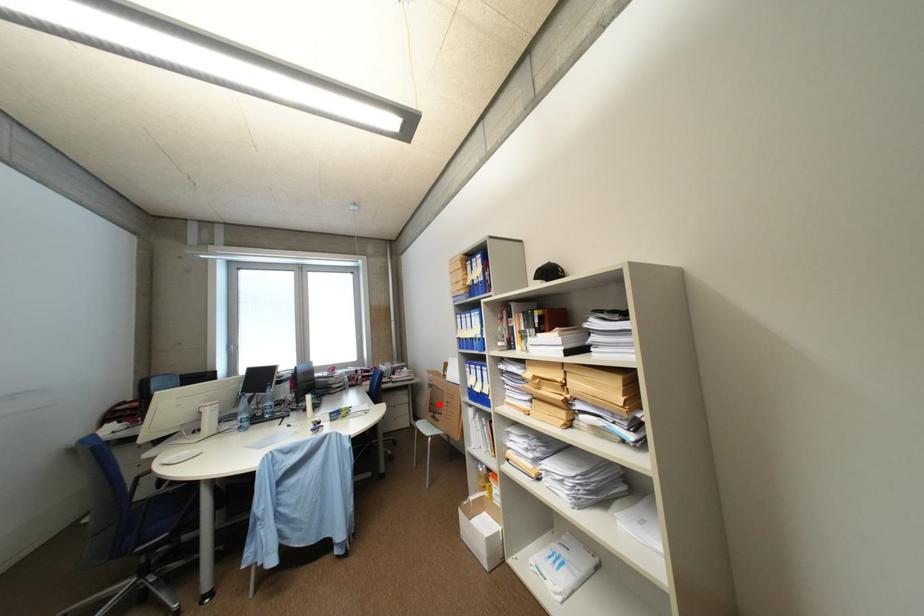
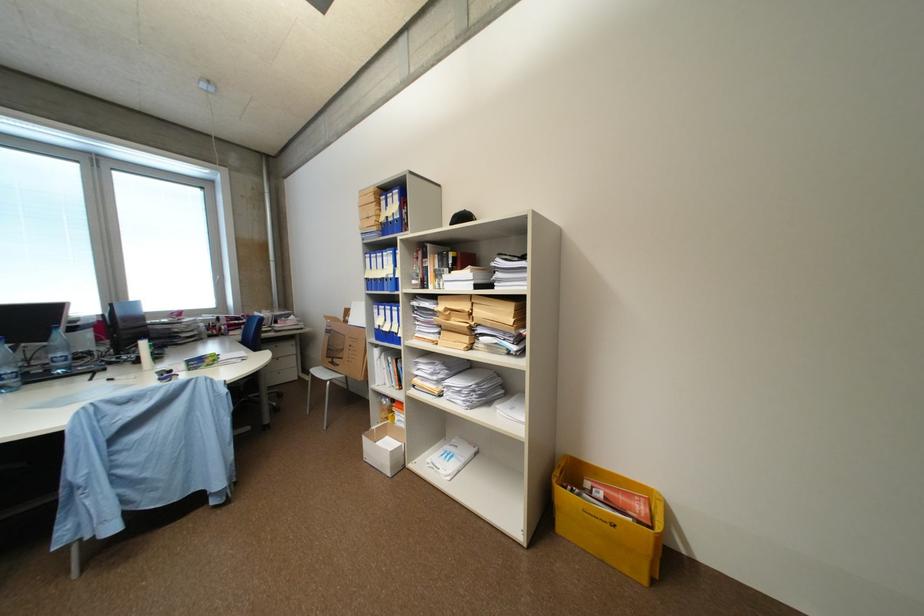
Find the pixel in the second image that matches the highlighted location in the first image.

(336, 350)